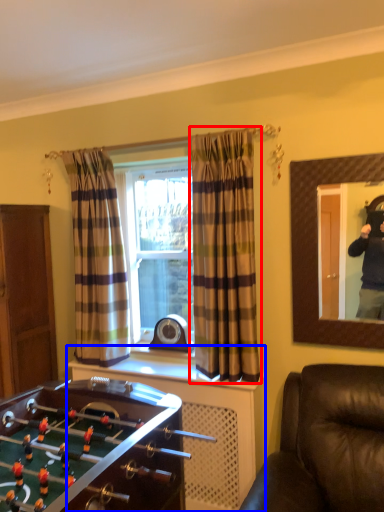
Question: Which of the following is the closest to the observer, curtain (highlighted by a red box) or dresser (highlighted by a blue box)?

Choices:
 (A) curtain
 (B) dresser

Answer: (B)